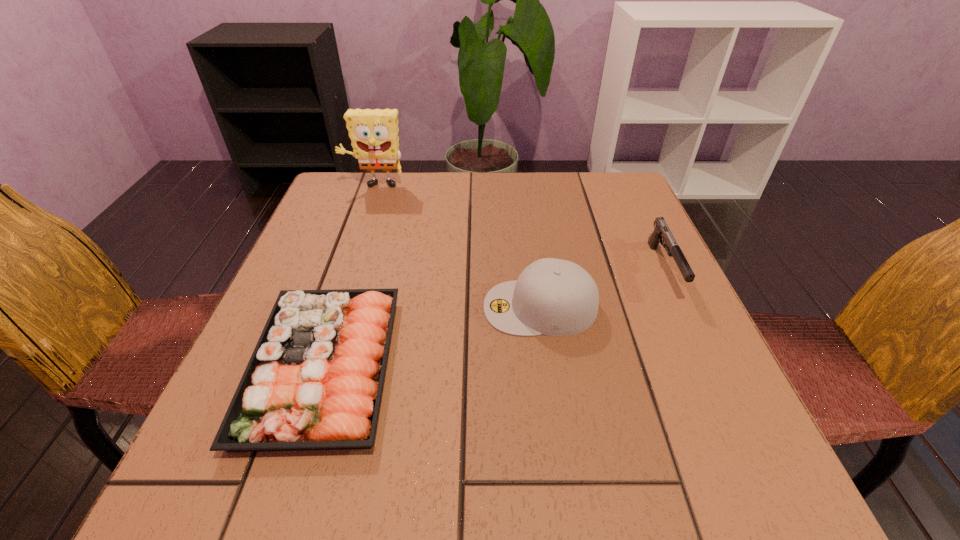
Identify the location of the tallest object. (374, 137).

The height and width of the screenshot is (540, 960). What are the coordinates of `sponge` in the screenshot? It's located at (374, 137).

This screenshot has width=960, height=540. What are the coordinates of `the third object from left to right` in the screenshot? It's located at (555, 297).

What are the coordinates of `gun` in the screenshot? It's located at tap(661, 230).

This screenshot has height=540, width=960. I want to click on the third tallest object, so click(661, 230).

I want to click on the shortest object, so click(x=314, y=381).

Find the location of `free space located 0.190m on the face of the tallest object`. free space located 0.190m on the face of the tallest object is located at coordinates (358, 238).

I want to click on free space located 0.080m on the front-facing side of the third object from left to right, so pos(443,307).

Where is `vacant space located on the front-facing side of the third object from left to right`? The height and width of the screenshot is (540, 960). vacant space located on the front-facing side of the third object from left to right is located at coordinates (447, 307).

You are a GUI agent. You are given a task and a screenshot of the screen. Output one action in this format:
    pyautogui.click(x=<x>, y=<y>)
    Task: Click on the vacant region located on the front-facing side of the third object from left to right
    This screenshot has height=540, width=960.
    Given the screenshot: What is the action you would take?
    pyautogui.click(x=412, y=307)